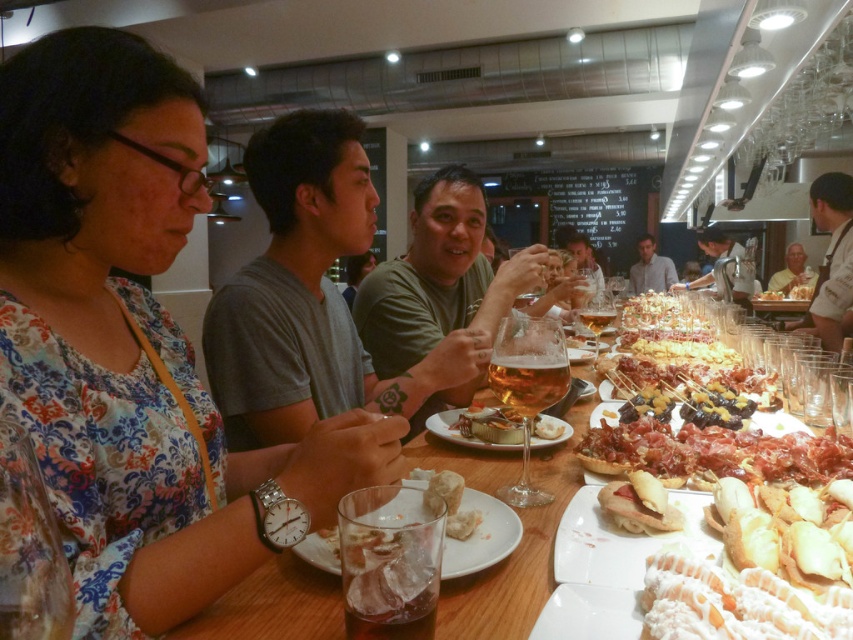
You are a waiter in a restaurant. You see a matte glass wine glass at center and a white matte face at upper right. Which object is closer to the ceiling?

The white matte face at upper right is closer to the ceiling because the matte glass wine glass at center is located below it.

You are a server in a restaurant and need to place a new dish on the table. The dish is too heavy to lift high, so you must place it on the lowest available spot. Which object should you choose between the white creamy cheese at center and the metallic silver tray at upper center?

The white creamy cheese at center is located below the metallic silver tray at upper center, so you should place the dish on the white creamy cheese at center since it is the lower spot.

You are a customer sitting at the table in the restaurant. You want to read the menu written on the black chalkboard at upper center. Can you reach it without moving from your seat?

The black chalkboard at upper center is positioned at point (593,204), which is within a typical viewing angle from the table, so you can likely read it without moving.